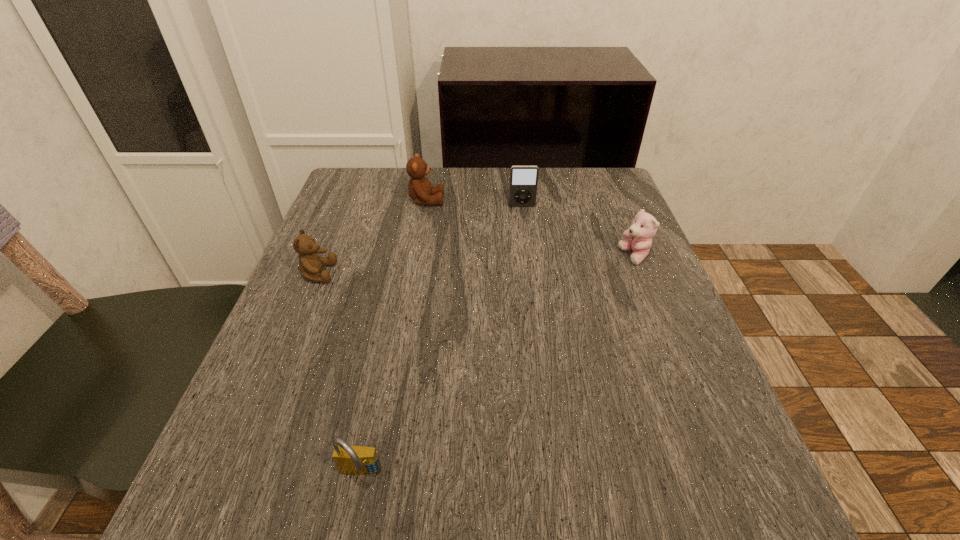
Image resolution: width=960 pixels, height=540 pixels. Find the location of `the farthest teddy bear`. the farthest teddy bear is located at coordinates (419, 187).

What are the coordinates of `iPod` in the screenshot? It's located at (523, 179).

Where is `the rightmost teddy bear`? The image size is (960, 540). the rightmost teddy bear is located at coordinates [644, 227].

This screenshot has width=960, height=540. In order to click on the leftmost object in this screenshot , I will do `click(310, 264)`.

Find the location of a particular element. Image resolution: width=960 pixels, height=540 pixels. padlock is located at coordinates (x=356, y=460).

Where is `vacant space located 0.110m on the face of the farthest teddy bear`? vacant space located 0.110m on the face of the farthest teddy bear is located at coordinates (488, 201).

Where is `free space located 0.240m on the front-facing side of the second object from right to left`? free space located 0.240m on the front-facing side of the second object from right to left is located at coordinates (530, 272).

Image resolution: width=960 pixels, height=540 pixels. In order to click on vacant space located at the face of the rightmost object in this screenshot , I will do `click(536, 256)`.

You are a GUI agent. You are given a task and a screenshot of the screen. Output one action in this format:
    pyautogui.click(x=<x>, y=<y>)
    Task: Click on the vacant space located 0.140m at the face of the rightmost object
    The height and width of the screenshot is (540, 960).
    Given the screenshot: What is the action you would take?
    pyautogui.click(x=555, y=256)

Identify the location of vacant area situated 0.050m at the face of the rightmost object. Image resolution: width=960 pixels, height=540 pixels. (596, 256).